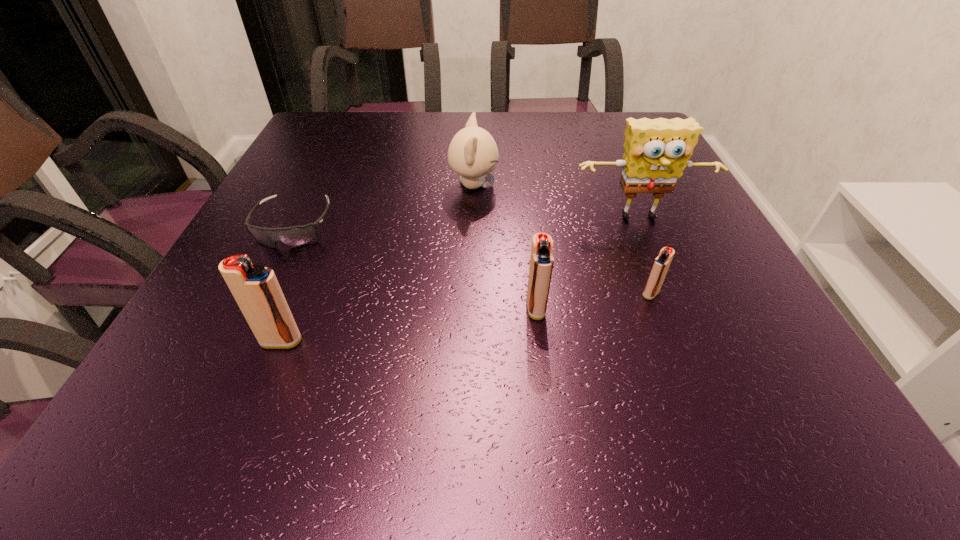
This screenshot has width=960, height=540. What are the coordinates of `vacant space that satisfies the following two spatial constraints: 1. on the face of the kitten; 2. on the lenses of the goggles` in the screenshot? It's located at (472, 226).

I want to click on vacant area that satisfies the following two spatial constraints: 1. on the lenses of the shortest igniter; 2. on the right side of the goggles, so click(260, 294).

Find the location of a particular element. This screenshot has height=540, width=960. free space that satisfies the following two spatial constraints: 1. on the face of the third object from left to right; 2. on the left side of the shortest igniter is located at coordinates (471, 294).

What are the coordinates of `blank area in the image that satisfies the following two spatial constraints: 1. on the lenses of the goggles; 2. on the left side of the rightmost igniter` in the screenshot? It's located at (260, 294).